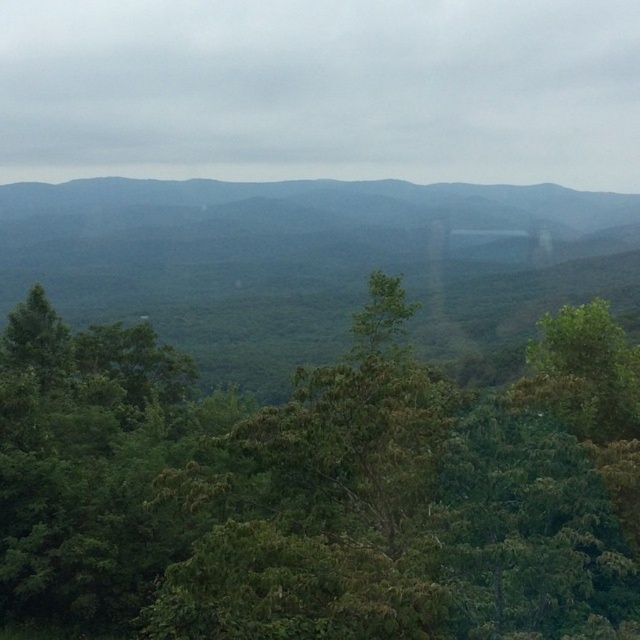
Question: Is the position of green leafy tree at center less distant than that of green leafy forest at center?

Choices:
 (A) yes
 (B) no

Answer: (A)

Question: Which point appears closest to the camera in this image?

Choices:
 (A) (368, 301)
 (B) (582, 276)

Answer: (A)

Question: Can you confirm if green leafy tree at center is positioned below green leafy forest at center?

Choices:
 (A) no
 (B) yes

Answer: (B)

Question: Observing the image, what is the correct spatial positioning of green leafy tree at center in reference to green leafy forest at center?

Choices:
 (A) above
 (B) below

Answer: (B)